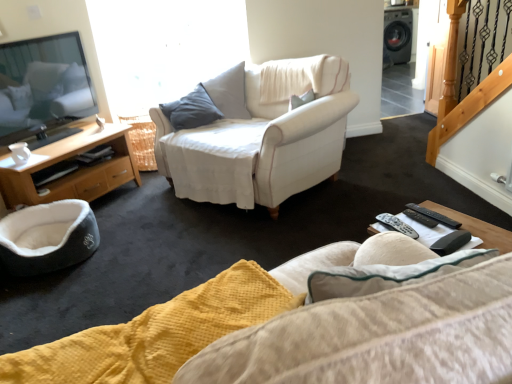
The image size is (512, 384). What do you see at coordinates (434, 216) in the screenshot? I see `black plastic remote at lower right, which is the first remote in right-to-left order` at bounding box center [434, 216].

This screenshot has height=384, width=512. What do you see at coordinates (72, 173) in the screenshot?
I see `wooden cabinet at left` at bounding box center [72, 173].

Find the location of a particular element. This screenshot has height=384, width=512. black plastic remote at lower right, the 2th remote viewed from the right is located at coordinates (420, 218).

I want to click on white fabric chair at center, so click(x=263, y=137).

The image size is (512, 384). What do you see at coordinates (263, 137) in the screenshot? I see `white fabric chair at center` at bounding box center [263, 137].

In order to face yellow textured fabric studio couch at lower center, should I rotate leftwards or rightwards?

Rotate your view left by about 4.227°.

The image size is (512, 384). What do you see at coordinates (174, 326) in the screenshot?
I see `yellow textured fabric studio couch at lower center` at bounding box center [174, 326].

I want to click on dark gray plush pet bed at lower left, so click(x=48, y=237).

Is black plastic remote at lower right, acting as the third remote starting from the left, surrounded by black plastic remote at lower right, positioned as the third remote in right-to-left order?

No, black plastic remote at lower right, acting as the third remote starting from the left, is not surrounded by black plastic remote at lower right, positioned as the third remote in right-to-left order.

Does black plastic remote at lower right, the 1th remote when ordered from left to right, appear on the left side of black plastic remote at lower right, acting as the third remote starting from the left?

Yes, black plastic remote at lower right, the 1th remote when ordered from left to right, is to the left of black plastic remote at lower right, acting as the third remote starting from the left.

In terms of height, does black plastic remote at lower right, positioned as the third remote in right-to-left order, look taller or shorter compared to black plastic remote at lower right, which is the first remote in right-to-left order?

In the image, black plastic remote at lower right, positioned as the third remote in right-to-left order, appears to be taller than black plastic remote at lower right, which is the first remote in right-to-left order.

Is point (412, 231) positioned behind point (460, 226)?

No, it is in front of (460, 226).

Is the depth of black plastic remote at lower right, acting as the third remote starting from the left, greater than that of wooden cabinet at left?

No, black plastic remote at lower right, acting as the third remote starting from the left, is in front of wooden cabinet at left.

From the image's perspective, is black plastic remote at lower right, acting as the third remote starting from the left, located above or below wooden cabinet at left?

Based on their image positions, black plastic remote at lower right, acting as the third remote starting from the left, is located beneath wooden cabinet at left.

How far apart are black plastic remote at lower right, which is the first remote in right-to-left order, and wooden cabinet at left?

black plastic remote at lower right, which is the first remote in right-to-left order, and wooden cabinet at left are 2.25 meters apart.

Is wooden cabinet at left located within black plastic remote at lower right, which is the first remote in right-to-left order?

No.

At what (x,y) coordinates should I click in order to perform the action: click on coffee table above the dark gray plush pet bed at lower left (from the image's perspective). Please return your answer as a coordinate pair (x, y). The width and height of the screenshot is (512, 384). Looking at the image, I should click on (477, 228).

From a real-world perspective, between black plastic remote control at lower right and dark gray plush pet bed at lower left, who is vertically higher?

black plastic remote control at lower right is physically above.

Can you confirm if black plastic remote control at lower right is shorter than dark gray plush pet bed at lower left?

Correct, black plastic remote control at lower right is not as tall as dark gray plush pet bed at lower left.

Consider the image. From the image's perspective, would you say black plastic remote control at lower right is shown under dark gray plush pet bed at lower left?

No.

Where is `chair that is on the left side of black plastic remote at lower right, which is the first remote in right-to-left order`? The height and width of the screenshot is (384, 512). chair that is on the left side of black plastic remote at lower right, which is the first remote in right-to-left order is located at coordinates (263, 137).

Would you consider white fabric chair at center to be distant from black plastic remote at lower right, acting as the third remote starting from the left?

That's right, there is a large distance between white fabric chair at center and black plastic remote at lower right, acting as the third remote starting from the left.

Based on the photo, which object is wider, white fabric chair at center or black plastic remote at lower right, which is the first remote in right-to-left order?

white fabric chair at center is wider.

In the scene shown: Is white fabric chair at center to the left or to the right of black plastic remote at lower right, which is the first remote in right-to-left order, in the image?

white fabric chair at center is to the left of black plastic remote at lower right, which is the first remote in right-to-left order.

Which of these two, black plastic remote control at lower right or black plastic remote at lower right, the 1th remote when ordered from left to right, stands shorter?

black plastic remote control at lower right is shorter.

From the image's perspective, is black plastic remote control at lower right beneath black plastic remote at lower right, positioned as the third remote in right-to-left order?

Yes.

Is black plastic remote at lower right, the 1th remote when ordered from left to right, surrounded by black plastic remote control at lower right?

Yes.

Which of these two, black plastic remote control at lower right or black plastic remote at lower right, the 1th remote when ordered from left to right, is smaller?

With smaller size is black plastic remote at lower right, the 1th remote when ordered from left to right.

How many degrees apart are the facing directions of wooden cabinet at left and black plastic remote control at lower right?

The facing directions of wooden cabinet at left and black plastic remote control at lower right are 150 degrees apart.

Is wooden cabinet at left oriented away from black plastic remote control at lower right?

wooden cabinet at left does not have its back to black plastic remote control at lower right.

Which object is wider, wooden cabinet at left or black plastic remote control at lower right?

wooden cabinet at left is wider.

In the scene shown: From the image's perspective, does wooden cabinet at left appear higher than black plastic remote control at lower right?

Yes, from the image's perspective, wooden cabinet at left is above black plastic remote control at lower right.

Considering the relative sizes of dark gray plush pet bed at lower left and black plastic remote at lower right, positioned as the third remote in right-to-left order, in the image provided, is dark gray plush pet bed at lower left wider than black plastic remote at lower right, positioned as the third remote in right-to-left order,?

Indeed, dark gray plush pet bed at lower left has a greater width compared to black plastic remote at lower right, positioned as the third remote in right-to-left order.

Is dark gray plush pet bed at lower left touching black plastic remote at lower right, positioned as the third remote in right-to-left order?

dark gray plush pet bed at lower left and black plastic remote at lower right, positioned as the third remote in right-to-left order, are clearly separated.

Relative to black plastic remote at lower right, the 1th remote when ordered from left to right, is dark gray plush pet bed at lower left in front or behind?

dark gray plush pet bed at lower left is positioned farther from the viewer than black plastic remote at lower right, the 1th remote when ordered from left to right.

Considering the sizes of dark gray plush pet bed at lower left and black plastic remote at lower right, the 1th remote when ordered from left to right, in the image, is dark gray plush pet bed at lower left bigger or smaller than black plastic remote at lower right, the 1th remote when ordered from left to right,?

dark gray plush pet bed at lower left is bigger than black plastic remote at lower right, the 1th remote when ordered from left to right.

From the image's perspective, starting from the black plastic remote at lower right, the 1th remote when ordered from left to right, which remote is the 2nd one above? Please provide its 2D coordinates.

[(434, 216)]

This screenshot has width=512, height=384. In order to click on cabinetry that is on the left side of black plastic remote at lower right, acting as the third remote starting from the left in this screenshot , I will do `click(72, 173)`.

Based on their spatial positions, is black plastic remote control at lower right or wooden cabinet at left closer to dark gray plush pet bed at lower left?

wooden cabinet at left is positioned closer to the anchor dark gray plush pet bed at lower left.

Which object lies further to the anchor point black plastic remote at lower right, the 1th remote when ordered from left to right, black plastic remote at lower right, which is the first remote in right-to-left order, or wooden cabinet at left?

wooden cabinet at left.

Estimate the real-world distances between objects in this image. Which object is further from dark gray plush pet bed at lower left, white fabric chair at center or black plastic remote at lower right, the 1th remote when ordered from left to right?

Among the two, black plastic remote at lower right, the 1th remote when ordered from left to right, is located further to dark gray plush pet bed at lower left.

Estimate the real-world distances between objects in this image. Which object is closer to yellow textured fabric studio couch at lower center, black plastic remote at lower right, the 2th remote viewed from the right, or black plastic remote at lower right, which is the first remote in right-to-left order?

Based on the image, black plastic remote at lower right, the 2th remote viewed from the right, appears to be nearer to yellow textured fabric studio couch at lower center.

Considering their positions, is wooden cabinet at left positioned closer to black plastic remote at lower right, marked as the second remote in a left-to-right arrangement, than dark gray plush pet bed at lower left?

dark gray plush pet bed at lower left.

Estimate the real-world distances between objects in this image. Which object is closer to black plastic remote at lower right, which is the first remote in right-to-left order, yellow textured fabric studio couch at lower center or white fabric chair at center?

yellow textured fabric studio couch at lower center is closer to black plastic remote at lower right, which is the first remote in right-to-left order.

Considering their positions, is black plastic remote at lower right, marked as the second remote in a left-to-right arrangement, positioned closer to black plastic remote at lower right, the 1th remote when ordered from left to right, than black plastic remote control at lower right?

The object closer to black plastic remote at lower right, the 1th remote when ordered from left to right, is black plastic remote at lower right, marked as the second remote in a left-to-right arrangement.

Estimate the real-world distances between objects in this image. Which object is closer to black plastic remote at lower right, the 2th remote viewed from the right, yellow textured fabric studio couch at lower center or dark gray plush pet bed at lower left?

Based on the image, yellow textured fabric studio couch at lower center appears to be nearer to black plastic remote at lower right, the 2th remote viewed from the right.

The width and height of the screenshot is (512, 384). Identify the location of coffee table between dark gray plush pet bed at lower left and black plastic remote at lower right, the 2th remote viewed from the right. (477, 228).

At what (x,y) coordinates should I click in order to perform the action: click on chair between dark gray plush pet bed at lower left and black plastic remote at lower right, the 2th remote viewed from the right, in the horizontal direction. Please return your answer as a coordinate pair (x, y). Image resolution: width=512 pixels, height=384 pixels. Looking at the image, I should click on (263, 137).

Where is `remote between wooden cabinet at left and black plastic remote control at lower right`? This screenshot has width=512, height=384. remote between wooden cabinet at left and black plastic remote control at lower right is located at coordinates (396, 225).

Identify the location of remote located between yellow textured fabric studio couch at lower center and black plastic remote at lower right, which is the first remote in right-to-left order, in the depth direction. (396, 225).